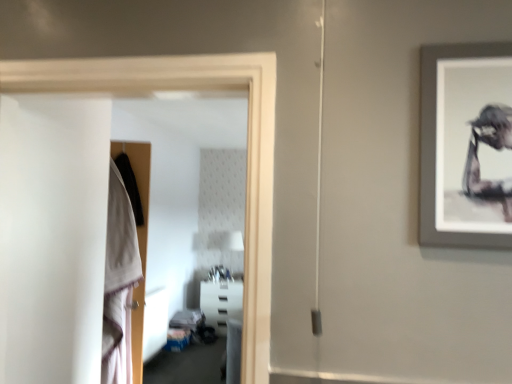
Question: Relative to transparent glass door at left, is white plastic shelf at center in front or behind?

Choices:
 (A) behind
 (B) front

Answer: (A)

Question: In terms of height, does white plastic shelf at center look taller or shorter compared to transparent glass door at left?

Choices:
 (A) short
 (B) tall

Answer: (A)

Question: Which object is the farthest from the white plastic shelf at center?

Choices:
 (A) white cotton robe at left
 (B) transparent glass door at left

Answer: (B)

Question: Which of these objects is positioned farthest from the white cotton robe at left?

Choices:
 (A) transparent glass door at left
 (B) white plastic shelf at center

Answer: (B)